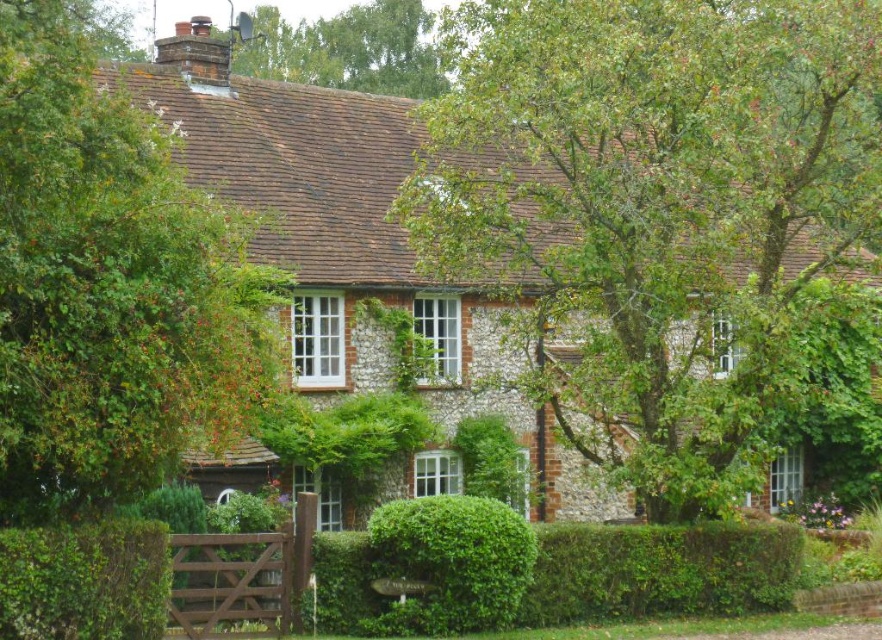
Between point (757, 577) and point (21, 566), which one is positioned in front?

Point (21, 566)

Which of these two, green leafy hedge at lower right or green leafy hedge at lower left, stands shorter?

With less height is green leafy hedge at lower right.

Between point (589, 536) and point (71, 584), which one is positioned in front?

Point (71, 584)

Locate an element on the screen. green leafy hedge at lower right is located at coordinates (660, 570).

Looking at this image, can you confirm if green leafy tree at left is taller than green leafy hedge at lower left?

Indeed, green leafy tree at left has a greater height compared to green leafy hedge at lower left.

Is green leafy tree at left behind green leafy hedge at lower left?

No, green leafy tree at left is in front of green leafy hedge at lower left.

Locate an element on the screen. green leafy tree at left is located at coordinates (109, 288).

Between point (116, 536) and point (423, 76), which one is positioned behind?

The point (423, 76) is behind.

Which is below, green leafy hedge at lower left or green leafy tree at upper center?

green leafy hedge at lower left

Which is behind, point (68, 540) or point (365, 65)?

Point (365, 65)

Find the location of a particular element. This screenshot has height=640, width=882. green leafy hedge at lower left is located at coordinates (84, 580).